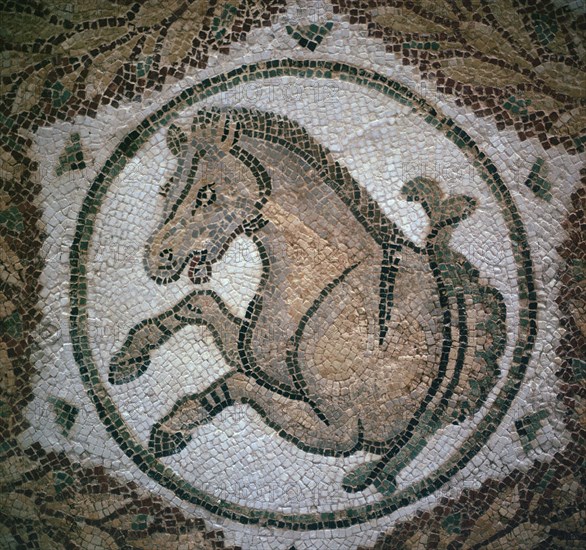
Where is `art`? The height and width of the screenshot is (550, 586). art is located at coordinates (325, 359).